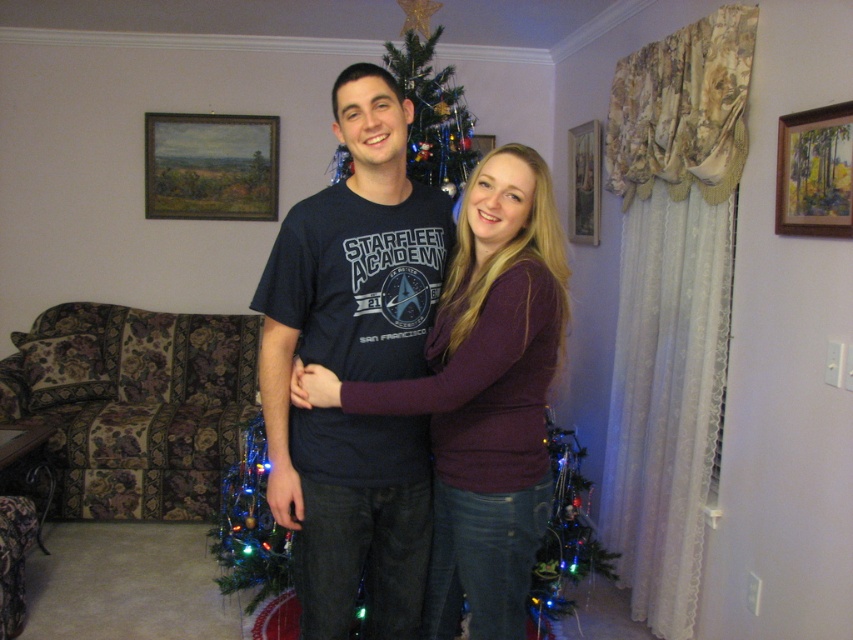
Between multicolored lights at lower left and wooden picture frame at upper center, which one appears on the left side from the viewer's perspective?

From the viewer's perspective, multicolored lights at lower left appears more on the left side.

Between point (238, 481) and point (480, 141), which one is positioned in front?

Point (238, 481) is in front.

Is point (219, 536) positioned after point (485, 145)?

No, it is not.

Where is `multicolored lights at lower left`? multicolored lights at lower left is located at coordinates (248, 524).

Which of these two, green matte christmas tree at lower right or wooden picture frame at upper center, stands shorter?

Standing shorter between the two is wooden picture frame at upper center.

Does green matte christmas tree at lower right come behind wooden picture frame at upper center?

No, green matte christmas tree at lower right is in front of wooden picture frame at upper center.

Where is `green matte christmas tree at lower right`? The height and width of the screenshot is (640, 853). green matte christmas tree at lower right is located at coordinates (564, 536).

From the picture: Is the position of maroon sweater at center more distant than that of shiny metallic tree at center?

No, it is not.

Does point (460, 308) come farther from viewer compared to point (413, 154)?

No, it is in front of (413, 154).

I want to click on maroon sweater at center, so click(x=482, y=396).